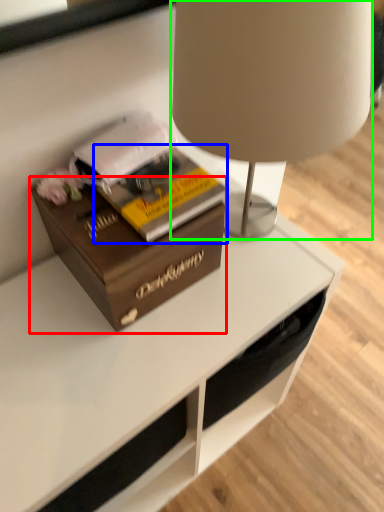
Question: Which object is positioned farthest from box (highlighted by a red box)? Select from paperback book (highlighted by a blue box) and lamp (highlighted by a green box).

Choices:
 (A) paperback book
 (B) lamp

Answer: (B)